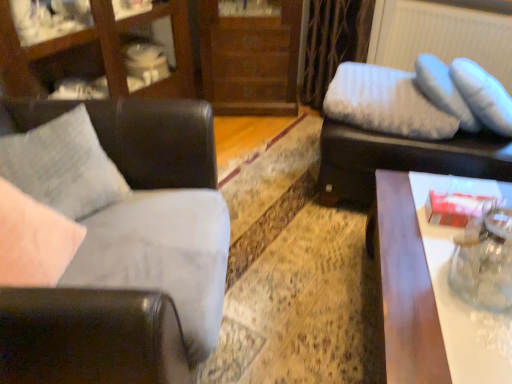
Question: Considering the relative positions of white glossy table at right and matte black swivel chair at upper right in the image provided, is white glossy table at right to the left of matte black swivel chair at upper right from the viewer's perspective?

Choices:
 (A) yes
 (B) no

Answer: (A)

Question: Is white glossy table at right smaller than matte black swivel chair at upper right?

Choices:
 (A) no
 (B) yes

Answer: (A)

Question: Can you confirm if white glossy table at right is bigger than matte black swivel chair at upper right?

Choices:
 (A) no
 (B) yes

Answer: (B)

Question: Is white glossy table at right wider than matte black swivel chair at upper right?

Choices:
 (A) yes
 (B) no

Answer: (A)

Question: Is matte black swivel chair at upper right located within white glossy table at right?

Choices:
 (A) no
 (B) yes

Answer: (A)

Question: Does white glossy table at right appear on the right side of matte black swivel chair at upper right?

Choices:
 (A) no
 (B) yes

Answer: (A)

Question: From the image's perspective, would you say matte wood entertainment center at upper left is shown under white fabric radiator at upper right?

Choices:
 (A) no
 (B) yes

Answer: (B)

Question: Considering the relative positions of matte wood entertainment center at upper left and white fabric radiator at upper right in the image provided, is matte wood entertainment center at upper left in front of white fabric radiator at upper right?

Choices:
 (A) no
 (B) yes

Answer: (B)

Question: Considering the relative sizes of matte wood entertainment center at upper left and white fabric radiator at upper right in the image provided, is matte wood entertainment center at upper left thinner than white fabric radiator at upper right?

Choices:
 (A) no
 (B) yes

Answer: (A)

Question: Does matte wood entertainment center at upper left have a greater height compared to white fabric radiator at upper right?

Choices:
 (A) yes
 (B) no

Answer: (A)

Question: Is the surface of matte wood entertainment center at upper left in direct contact with white fabric radiator at upper right?

Choices:
 (A) yes
 (B) no

Answer: (B)

Question: Is matte wood entertainment center at upper left not within white fabric radiator at upper right?

Choices:
 (A) yes
 (B) no

Answer: (A)

Question: From the image's perspective, is wooden dresser at center located beneath textured gray pillow at left, the first pillow positioned from the left?

Choices:
 (A) yes
 (B) no

Answer: (B)